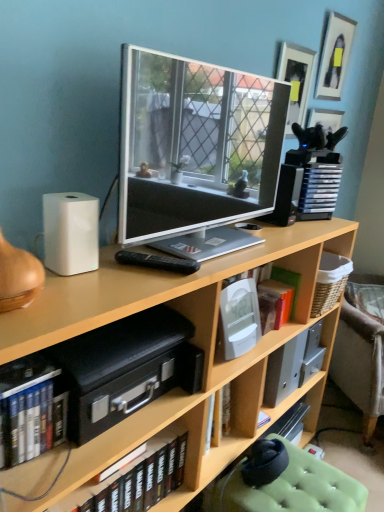
Image resolution: width=384 pixels, height=512 pixels. Identify the location of vacant space in front of black plastic remote at center. (137, 287).